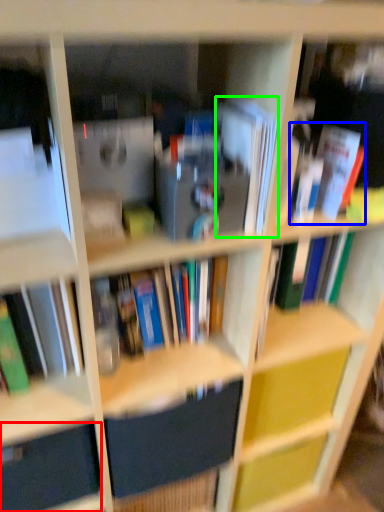
Question: Based on their relative distances, which object is farther from drawer (highlighted by a red box)? Choose from book (highlighted by a blue box) and paperback book (highlighted by a green box).

Choices:
 (A) book
 (B) paperback book

Answer: (A)